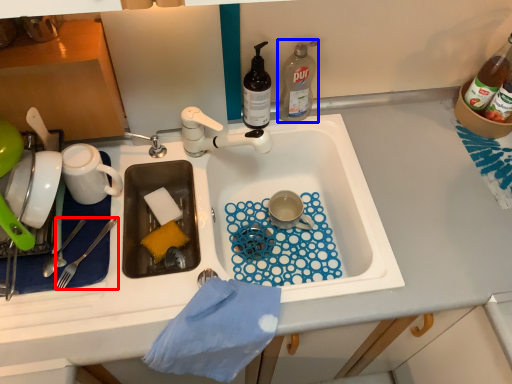
Question: Which object appears closest to the camera in this image, fork (highlighted by a red box) or bottle (highlighted by a blue box)?

Choices:
 (A) fork
 (B) bottle

Answer: (A)